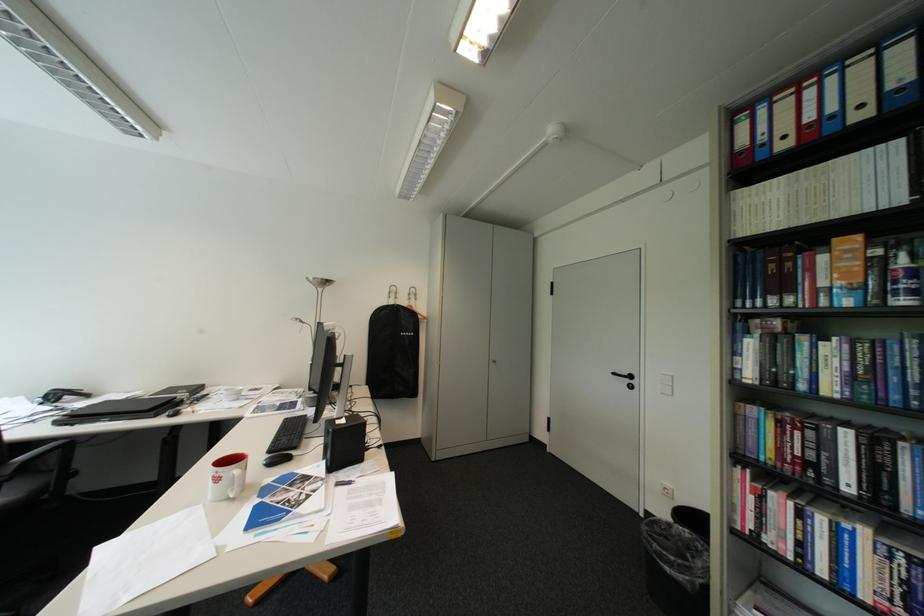
The location [904,282] corresponds to which object?

It corresponds to the blue and white can in the image.